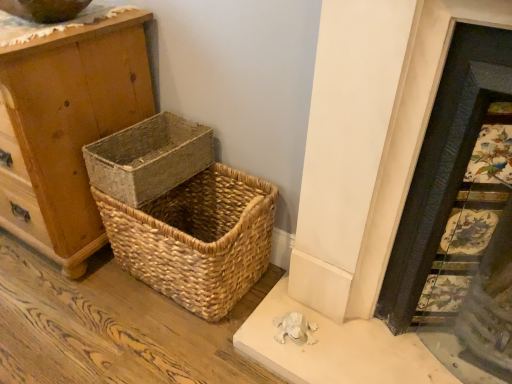
Question: Is natural woven basket at center, which is the second picnic basket in bottom-to-top order, located within wooden chest of drawers at left?

Choices:
 (A) yes
 (B) no

Answer: (B)

Question: Can you confirm if wooden chest of drawers at left is wider than natural woven basket at center, which is the second picnic basket in bottom-to-top order?

Choices:
 (A) yes
 (B) no

Answer: (A)

Question: Considering the relative sizes of wooden chest of drawers at left and natural woven basket at center, the 1th picnic basket positioned from the top, in the image provided, is wooden chest of drawers at left thinner than natural woven basket at center, the 1th picnic basket positioned from the top,?

Choices:
 (A) yes
 (B) no

Answer: (B)

Question: Does wooden chest of drawers at left have a larger size compared to natural woven basket at center, the 1th picnic basket positioned from the top?

Choices:
 (A) yes
 (B) no

Answer: (A)

Question: Considering the relative sizes of wooden chest of drawers at left and natural woven basket at center, the 1th picnic basket positioned from the top, in the image provided, is wooden chest of drawers at left taller than natural woven basket at center, the 1th picnic basket positioned from the top,?

Choices:
 (A) no
 (B) yes

Answer: (B)

Question: Considering the relative positions of wooden chest of drawers at left and natural woven basket at center, which is the second picnic basket in bottom-to-top order, in the image provided, is wooden chest of drawers at left to the right of natural woven basket at center, which is the second picnic basket in bottom-to-top order, from the viewer's perspective?

Choices:
 (A) no
 (B) yes

Answer: (A)

Question: From the image's perspective, would you say wooden chest of drawers at left is positioned over decorative tile fireplace at right?

Choices:
 (A) yes
 (B) no

Answer: (A)

Question: Is wooden chest of drawers at left shorter than decorative tile fireplace at right?

Choices:
 (A) no
 (B) yes

Answer: (B)

Question: Is wooden chest of drawers at left touching decorative tile fireplace at right?

Choices:
 (A) no
 (B) yes

Answer: (A)

Question: Can decorative tile fireplace at right be found inside wooden chest of drawers at left?

Choices:
 (A) yes
 (B) no

Answer: (B)

Question: Is wooden chest of drawers at left further to the viewer compared to decorative tile fireplace at right?

Choices:
 (A) no
 (B) yes

Answer: (B)

Question: Can you confirm if wooden chest of drawers at left is thinner than decorative tile fireplace at right?

Choices:
 (A) no
 (B) yes

Answer: (A)

Question: Is decorative tile fireplace at right not near natural woven basket at center, the 1th picnic basket positioned from the top?

Choices:
 (A) no
 (B) yes

Answer: (A)